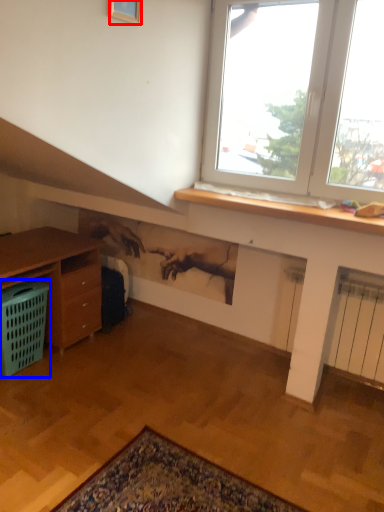
Question: Which of the following is the farthest to the observer, picture frame (highlighted by a red box) or basket (highlighted by a blue box)?

Choices:
 (A) picture frame
 (B) basket

Answer: (B)